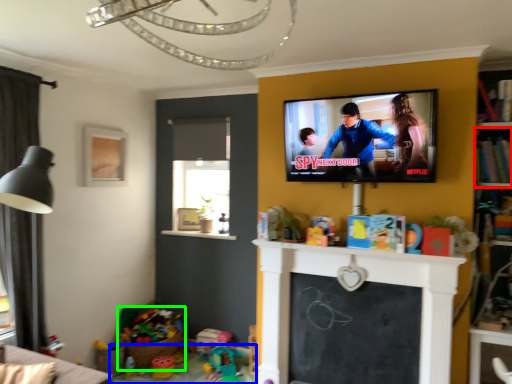
Question: Considering the real-world distances, which object is farthest from shelf (highlighted by a red box)? table (highlighted by a blue box) or toy (highlighted by a green box)?

Choices:
 (A) table
 (B) toy

Answer: (B)